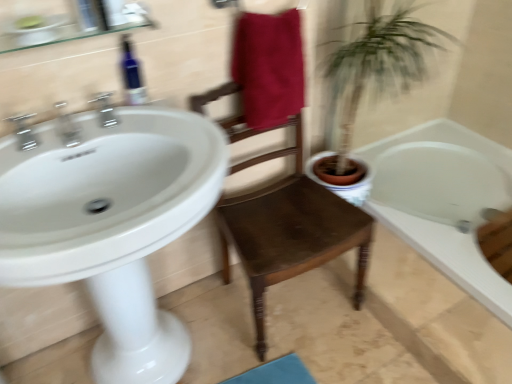
Locate an element on the screen. unoccupied area in front of silver metallic faucet at upper left, the first tap in the right-to-left sequence is located at coordinates [88, 144].